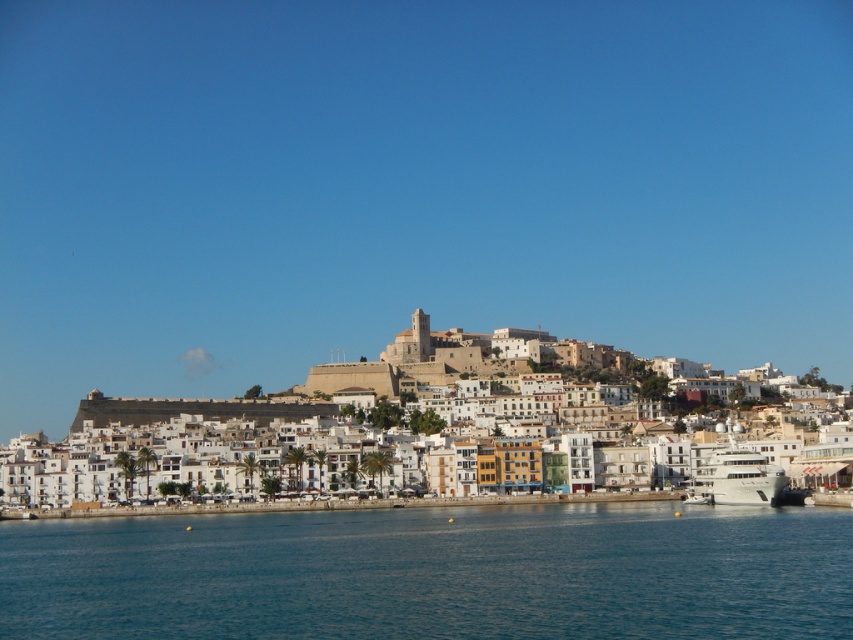
You are a tourist standing at the edge of the coastal town. You see the blue water at lower center and the white matte buildings at center. Which one is located to the right of the other?

The blue water at lower center is positioned on the right side of white matte buildings at center.

You are standing at the edge of the coastal town and want to take a photo that includes both the blue water at lower center and the white matte buildings at center. Given that your camera has a maximum focus range of 40 meters, will you be able to capture both subjects in focus without moving your position?

The blue water at lower center is 45.19 meters away from the white matte buildings at center. Since your camera can only focus up to 40 meters, you won that capture both subjects in focus without moving your position.